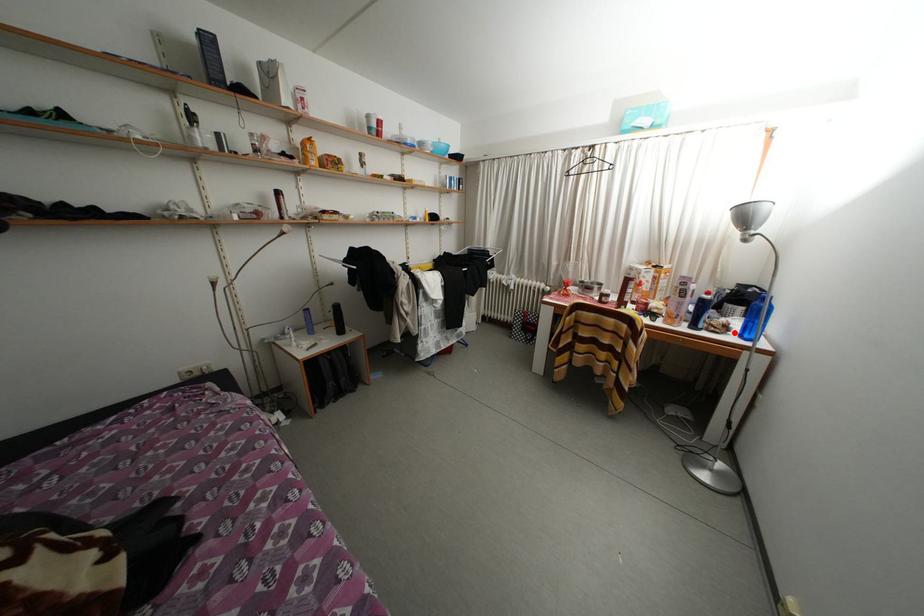
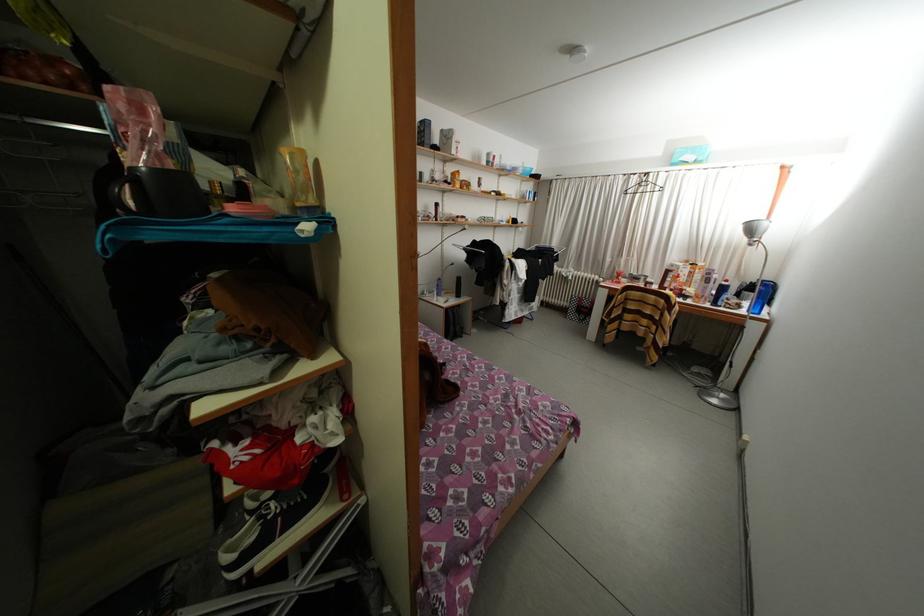
Locate, in the second image, the point that corresponds to the highlighted location in the first image.

(747, 310)